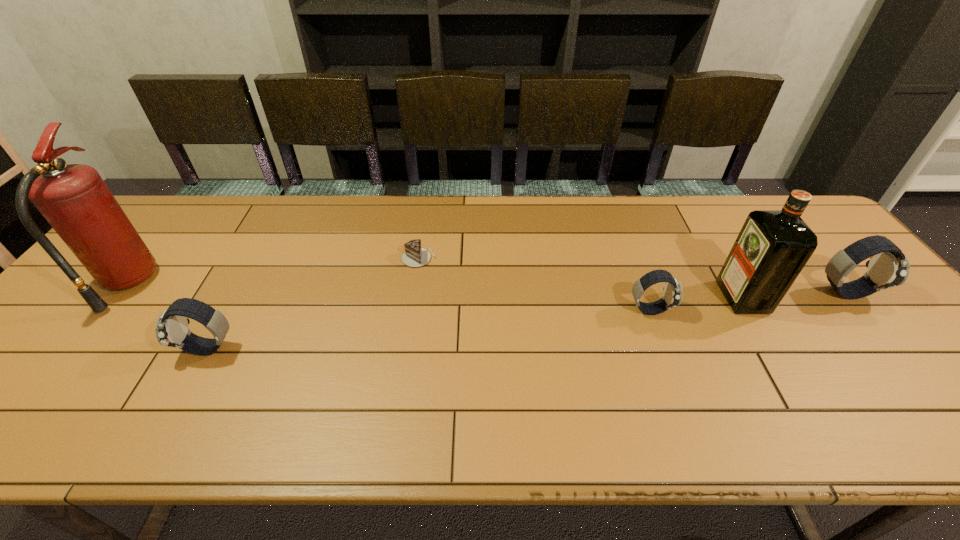
The image size is (960, 540). In order to click on liquor in this screenshot , I will do `click(773, 246)`.

Find the location of a particular element. vacant space situated on the face of the nearest watch is located at coordinates (134, 349).

Identify the location of vacant area located on the face of the nearest watch. This screenshot has height=540, width=960. (122, 349).

Find the location of `vacant space positioned 0.190m on the face of the nearest watch`. vacant space positioned 0.190m on the face of the nearest watch is located at coordinates (101, 349).

Where is `vacant space situated 0.330m on the face of the fourth object from left to right`? vacant space situated 0.330m on the face of the fourth object from left to right is located at coordinates (799, 309).

Locate an element on the screen. Image resolution: width=960 pixels, height=540 pixels. vacant position located 0.280m at the front of the leftmost object where the nozzle is aimed is located at coordinates pyautogui.click(x=255, y=283).

Locate an element on the screen. The image size is (960, 540). vacant space situated 0.160m on the back of the fourth object from right to left is located at coordinates (425, 217).

Where is `vacant area situated 0.100m on the front label of the second object from right to left`? This screenshot has width=960, height=540. vacant area situated 0.100m on the front label of the second object from right to left is located at coordinates (686, 297).

Where is `vacant space located on the front label of the second object from right to left`? The width and height of the screenshot is (960, 540). vacant space located on the front label of the second object from right to left is located at coordinates (618, 297).

I want to click on vacant space located 0.160m on the front label of the second object from right to left, so click(x=663, y=297).